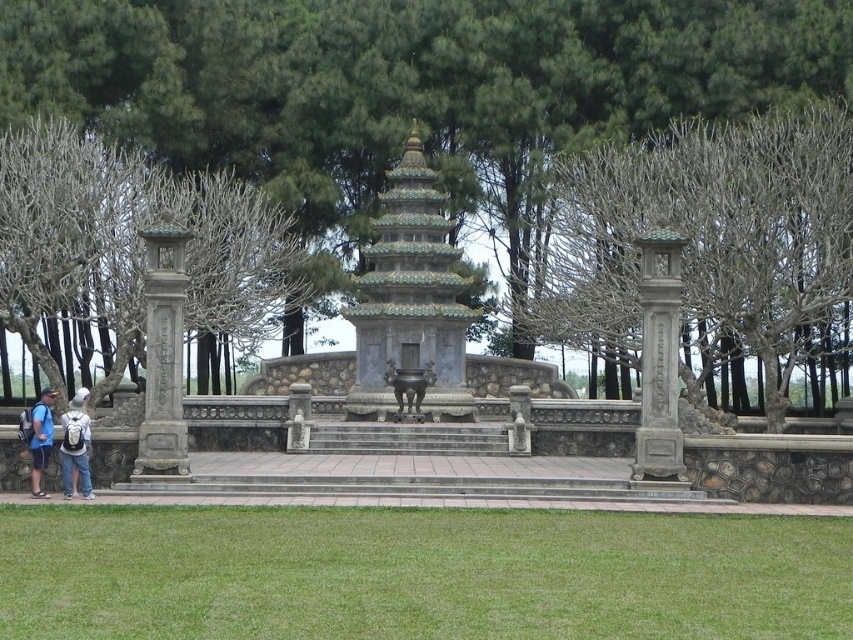
Does green glazed tile pagoda at center appear on the right side of gray stone pillar at right?

In fact, green glazed tile pagoda at center is to the left of gray stone pillar at right.

Who is positioned more to the right, green glazed tile pagoda at center or gray stone pillar at right?

Positioned to the right is gray stone pillar at right.

Is point (367, 298) farther from viewer compared to point (651, 438)?

That is True.

The image size is (853, 640). Find the location of `green glazed tile pagoda at center`. green glazed tile pagoda at center is located at coordinates (410, 289).

Between green stone lantern at center and denim shorts at lower left, which one appears on the right side from the viewer's perspective?

From the viewer's perspective, green stone lantern at center appears more on the right side.

Who is more distant from viewer, (807, 259) or (41, 468)?

The point (807, 259) is behind.

Where is `green stone lantern at center`? The height and width of the screenshot is (640, 853). green stone lantern at center is located at coordinates (711, 236).

Does bare branches at center have a lesser height compared to green glazed tile pagoda at center?

No, bare branches at center is not shorter than green glazed tile pagoda at center.

What do you see at coordinates (407, 90) in the screenshot?
I see `bare branches at center` at bounding box center [407, 90].

Image resolution: width=853 pixels, height=640 pixels. Find the location of `bare branches at center`. bare branches at center is located at coordinates (407, 90).